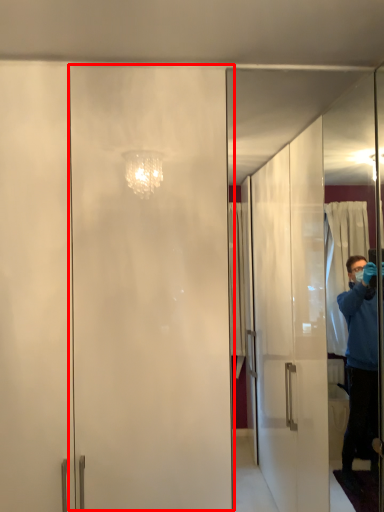
Question: In this image, where is screen door (annotated by the red box) located relative to screen door?

Choices:
 (A) right
 (B) left

Answer: (B)